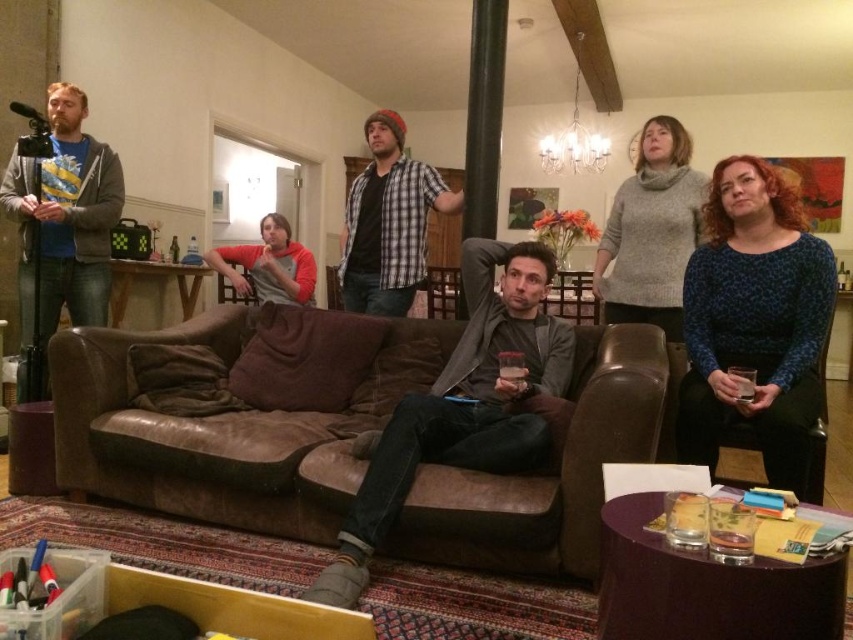
You are at a party and want to move from the checkered shirt at center to the suede couch at center. Which direction should you move?

To move from the checkered shirt at center to the suede couch at center, you should move to the right since the suede couch at center is located to the right of the checkered shirt at center.

You are a photographer setting up a shoot in the living room. You need to place a light source above the brown leather couch at center and the checkered shirt at center. According to the scene, where should you position the light source relative to these two objects?

The brown leather couch at center is positioned under the checkered shirt at center, so the light source should be placed above the checkered shirt at center to also illuminate the brown leather couch at center below it.

You are a photographer positioned at the back of the room. You need to take a photo that includes both the suede couch at center and the checkered shirt at center. Which object should you focus on first to ensure both are in frame?

The suede couch at center is closer to the viewer than the checkered shirt at center, so you should focus on the suede couch at center first to ensure both are in frame.